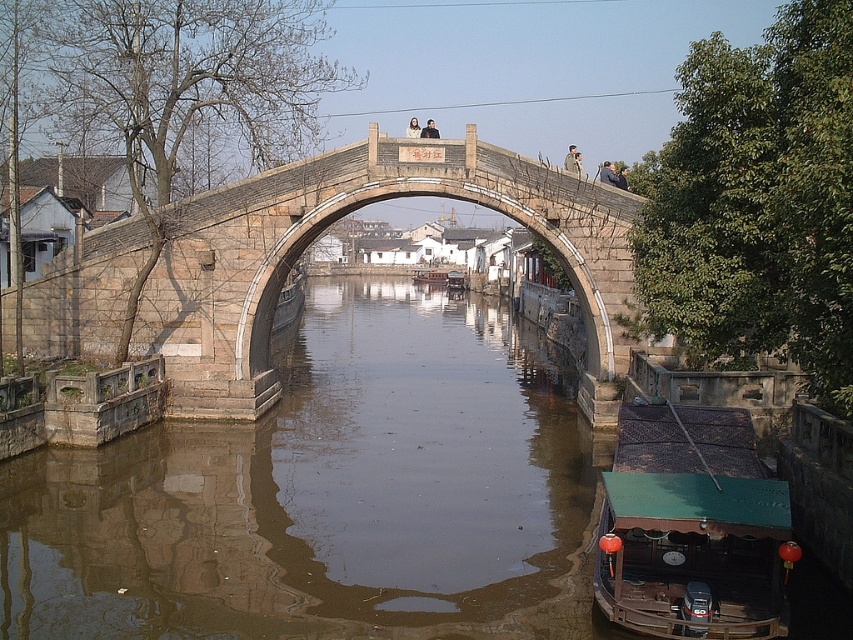
Between stone arch bridge at center and green canvas boat at lower right, which one is positioned higher?

stone arch bridge at center is above.

Which is in front, point (135, 241) or point (770, 480)?

Point (770, 480) is in front.

Locate an element on the screen. The width and height of the screenshot is (853, 640). stone arch bridge at center is located at coordinates (335, 220).

At what (x,y) coordinates should I click in order to perform the action: click on stone arch bridge at center. Please return your answer as a coordinate pair (x, y). This screenshot has height=640, width=853. Looking at the image, I should click on (335, 220).

Between green canvas boat at lower right and smooth skin face at upper center, which one has more height?

Standing taller between the two is smooth skin face at upper center.

In the scene shown: How far apart are green canvas boat at lower right and smooth skin face at upper center?

green canvas boat at lower right is 47.91 feet from smooth skin face at upper center.

Find the location of a particular element. This screenshot has height=640, width=853. green canvas boat at lower right is located at coordinates (692, 528).

In the scene shown: Who is shorter, light brown wooden bridge at center or smooth skin person at upper center?

With less height is smooth skin person at upper center.

Consider the image. Is light brown wooden bridge at center thinner than smooth skin person at upper center?

Yes, light brown wooden bridge at center is thinner than smooth skin person at upper center.

Between point (566, 157) and point (606, 172), which one is positioned behind?

The point (566, 157) is behind.

Where is `light brown wooden bridge at center`? light brown wooden bridge at center is located at coordinates (573, 161).